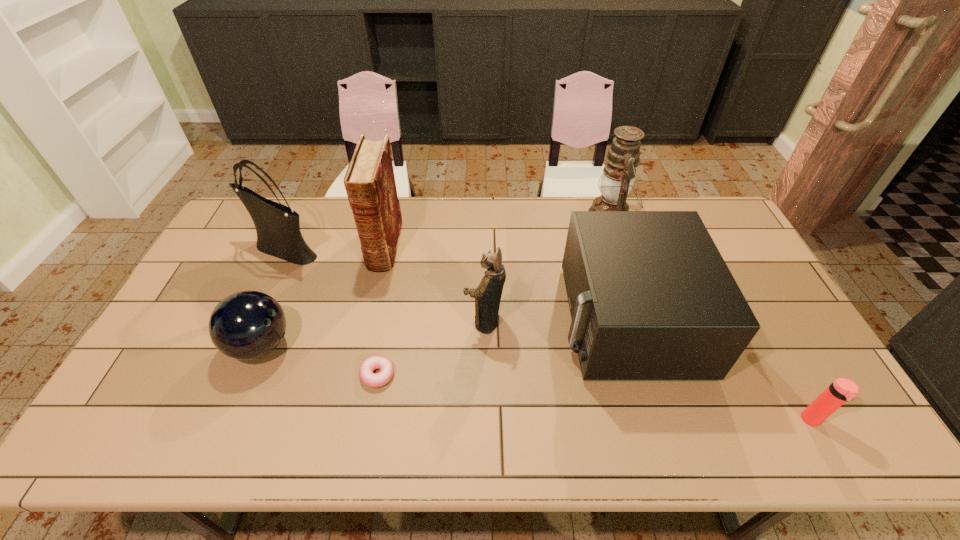
Where is `vacant space situated 0.280m on the front of the lantern`? vacant space situated 0.280m on the front of the lantern is located at coordinates (636, 298).

Identify the location of free space located 0.160m on the spine side of the hardback book. This screenshot has width=960, height=540. (370, 312).

Where is `vacant space located on the right of the shoulder bag`? vacant space located on the right of the shoulder bag is located at coordinates (422, 249).

At what (x,y) coordinates should I click in order to perform the action: click on vacant space situated 0.140m on the front-facing side of the fourth object from right to left. Please return your answer as a coordinate pair (x, y). The height and width of the screenshot is (540, 960). Looking at the image, I should click on (416, 321).

Find the location of a particular element. vacant space located 0.080m on the front-facing side of the fourth object from right to left is located at coordinates (437, 321).

Where is `free space located on the front-facing side of the fourth object from right to left`? The width and height of the screenshot is (960, 540). free space located on the front-facing side of the fourth object from right to left is located at coordinates (388, 321).

The image size is (960, 540). What are the coordinates of `free space located 0.140m on the front-facing side of the fifth tallest object` in the screenshot? It's located at (513, 320).

Find the location of a particular element. This screenshot has height=540, width=960. free space located on the front-facing side of the fifth tallest object is located at coordinates (474, 320).

Where is `free region located 0.270m on the front-facing side of the fifth tallest object`? free region located 0.270m on the front-facing side of the fifth tallest object is located at coordinates (468, 320).

The width and height of the screenshot is (960, 540). I want to click on vacant space positioned on the side of the bowling ball with the finger holes, so click(x=418, y=346).